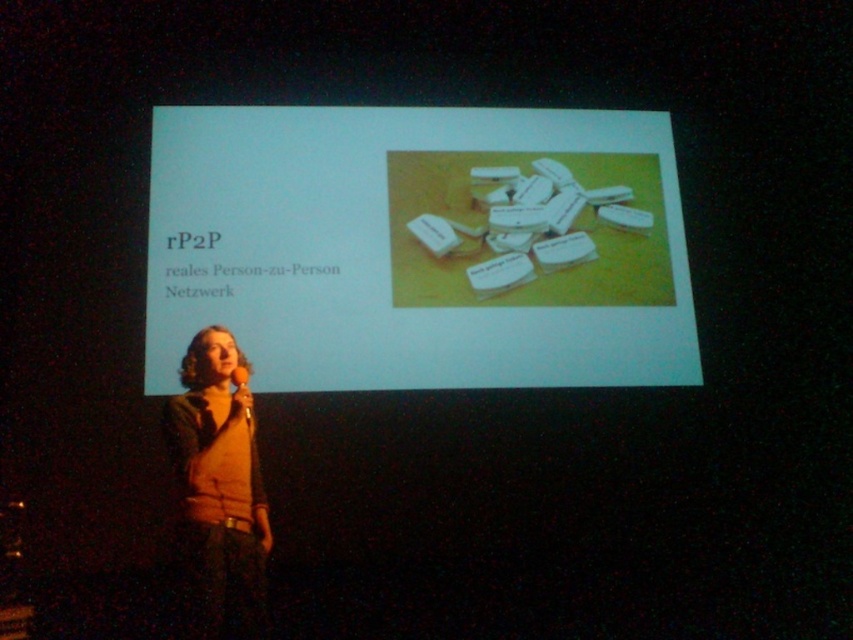
Locate an element on the screen. This screenshot has width=853, height=640. white paper at upper center is located at coordinates (421, 246).

Does white paper at upper center have a lesser height compared to matte orange sweater at center?

In fact, white paper at upper center may be taller than matte orange sweater at center.

Who is more forward, (392, 186) or (218, 442)?

Positioned in front is point (218, 442).

The image size is (853, 640). Find the location of `white paper at upper center`. white paper at upper center is located at coordinates (421, 246).